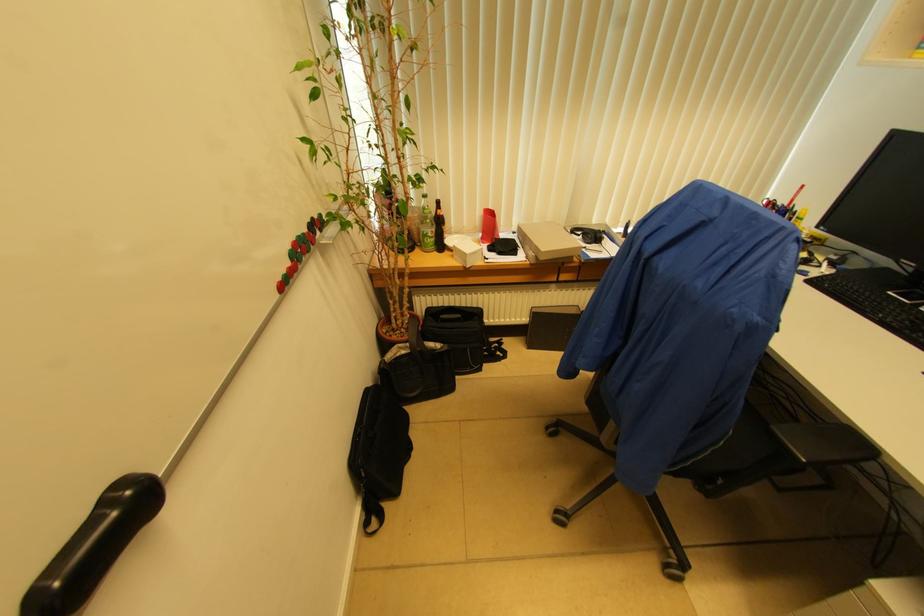
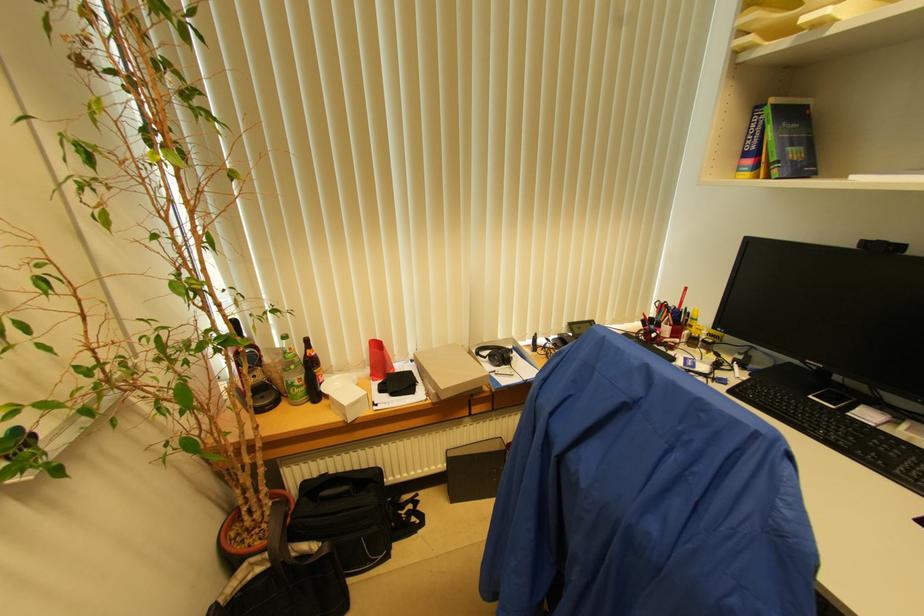
Locate, in the second image, the point that corresponds to pixel 517 233 in the first image.

(415, 361)